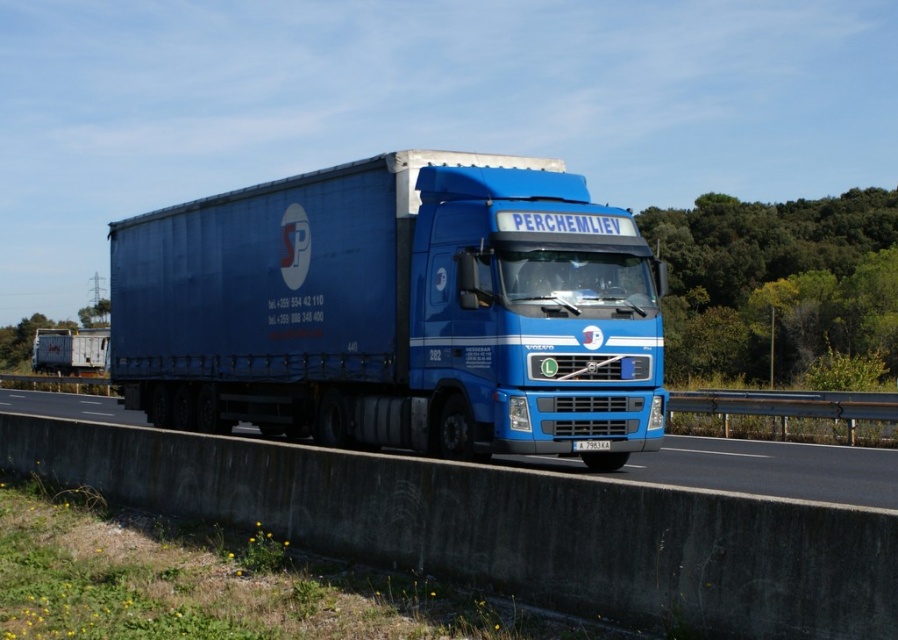
You are a delivery driver who needs to enter a tunnel with a height restriction of 4 meters. The tunnel has a sign stating that vehicles taller than 4 meters are prohibited. You are driving the blue metallic truck at center, which is hauling the blue matte trailer truck at center. Can you safely pass through the tunnel without violating the height restriction?

The blue matte trailer truck at center is taller than the blue metallic truck at center. Since the trailer is taller than the truck, and the tunnel restricts vehicles taller than 4 meters, you need to check the trailer height. If the trailer exceeds 4 meters, you cannot pass. However, the problem states the trailer is taller than the truck but doesn not provide exact heights. Without specific measurements, it is impossible to determine if the combined height violates the 4 meter limit. Therefore, you should

You are a truck driver who needs to park your vehicle in a parking spot that can only accommodate vehicles up to the size of the blue metallic truck at center. You have a vehicle similar in size to the blue matte trailer truck at center. Can you safely park your vehicle in this parking spot?

The blue matte trailer truck at center has a smaller size compared to blue metallic truck at center, so yes, the vehicle similar in size to the blue matte trailer truck at center can safely park in the parking spot designed for the blue metallic truck at center since it is smaller in size.

You are standing at a safe distance from the large blue semi truck. The truck has a point labeled at coordinates point (307, 209). Can you estimate how far you are from that point on the truck?

The distance between point (307, 209) and the viewer is 44.06 feet, so you are 44.06 feet away from that point on the truck.